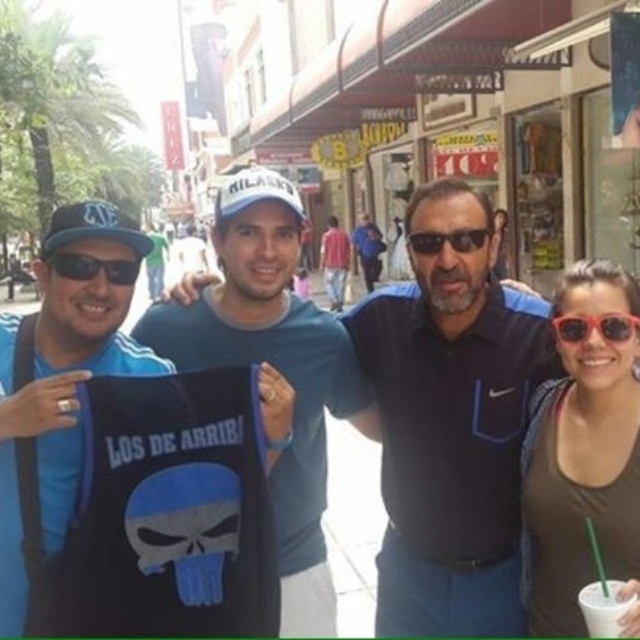
This screenshot has width=640, height=640. Describe the element at coordinates (61, 380) in the screenshot. I see `black matte t-shirt at left` at that location.

Find the location of a particular element. black matte t-shirt at left is located at coordinates (61, 380).

Who is more distant from viewer, [64,227] or [609,589]?

The point [64,227] is more distant.

Does matte black baseball cap at left have a greater height compared to white paper cup at lower right?

Indeed, matte black baseball cap at left has a greater height compared to white paper cup at lower right.

Which is in front, point (116, 220) or point (637, 632)?

Point (637, 632) is in front.

The height and width of the screenshot is (640, 640). I want to click on matte black baseball cap at left, so click(x=93, y=227).

Is black cotton t-shirt at center below matte black baseball cap at left?

Yes, black cotton t-shirt at center is below matte black baseball cap at left.

Is point (444, 426) positioned behind point (108, 232)?

Yes, point (444, 426) is farther from viewer.

Identify the location of black cotton t-shirt at center. This screenshot has height=640, width=640. (451, 426).